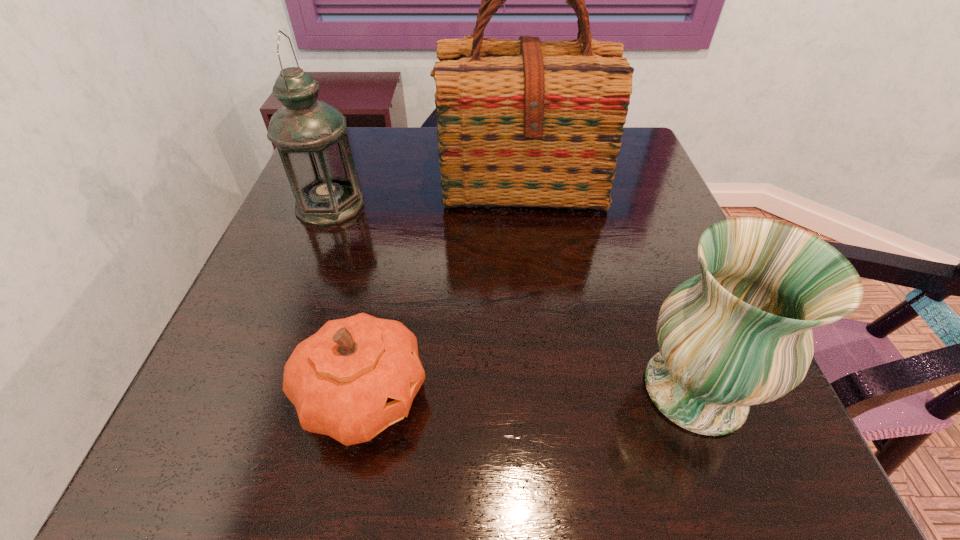
You are a GUI agent. You are given a task and a screenshot of the screen. Output one action in this format:
    pyautogui.click(x=<x>, y=<y>)
    Task: Click on the tallest object
    
    Given the screenshot: What is the action you would take?
    pyautogui.click(x=525, y=123)

You are a GUI agent. You are given a task and a screenshot of the screen. Output one action in this format:
    pyautogui.click(x=<x>, y=<y>)
    Task: Click on the oil lamp
    
    Given the screenshot: What is the action you would take?
    tap(309, 134)

At what (x,y) coordinates should I click in order to perform the action: click on vase. Please return your answer as a coordinate pair (x, y). The image size is (960, 540). Looking at the image, I should click on (739, 334).

Find the location of a particular element. Image resolution: width=960 pixels, height=540 pixels. pumpkin is located at coordinates (354, 377).

Find the location of a particular element. The height and width of the screenshot is (540, 960). vacant region located on the open handle side of the tallest object is located at coordinates (538, 330).

The width and height of the screenshot is (960, 540). In order to click on vacant area situated 0.380m on the right of the third shortest object in this screenshot , I will do `click(520, 205)`.

This screenshot has height=540, width=960. In order to click on vacant space located 0.380m on the back of the vase in this screenshot , I will do click(627, 211).

I want to click on free point located 0.110m on the front-facing side of the shortest object, so click(x=496, y=395).

Identify the location of object present at the far edge. (525, 123).

The height and width of the screenshot is (540, 960). I want to click on vase situated at the near edge, so click(739, 334).